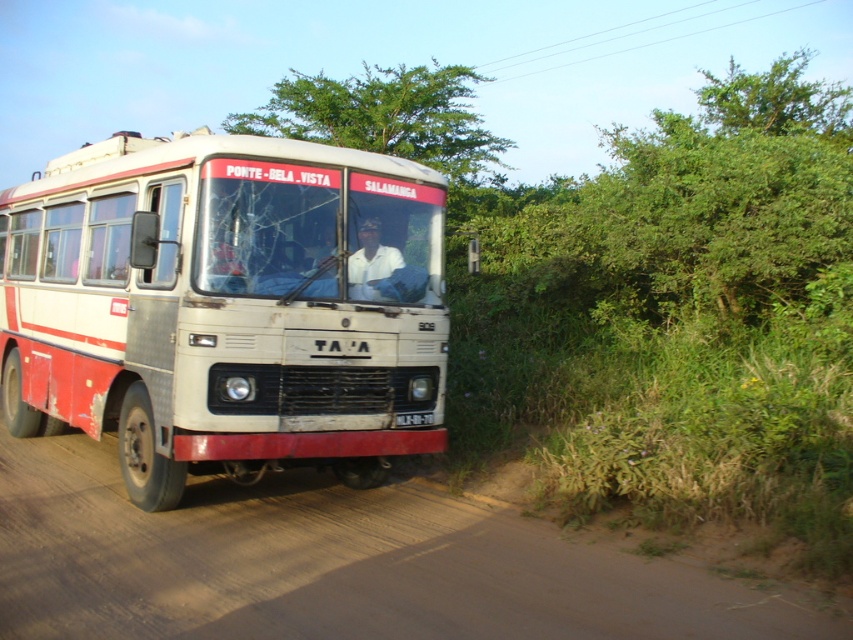
Measure the distance from white matte bus at center to brown dirt track at lower center.

white matte bus at center is 5.76 feet from brown dirt track at lower center.

Is white matte bus at center in front of brown dirt track at lower center?

No, white matte bus at center is further to the viewer.

The width and height of the screenshot is (853, 640). In order to click on white matte bus at center in this screenshot , I will do `click(222, 307)`.

Is white matte bus at center taller than black plastic license plate at center?

Indeed, white matte bus at center has a greater height compared to black plastic license plate at center.

Which is behind, point (357, 193) or point (399, 420)?

Point (399, 420)

Who is more forward, (302, 208) or (393, 422)?

Point (302, 208) is in front.

You are a GUI agent. You are given a task and a screenshot of the screen. Output one action in this format:
    pyautogui.click(x=<x>, y=<y>)
    Task: Click on the white matte bus at center
    The width and height of the screenshot is (853, 640).
    Given the screenshot: What is the action you would take?
    pyautogui.click(x=222, y=307)

How distant is white matte shirt at center from black plastic license plate at center?

A distance of 1.27 meters exists between white matte shirt at center and black plastic license plate at center.

Identify the location of white matte shirt at center. (370, 262).

Which is behind, point (370, 241) or point (419, 419)?

The point (419, 419) is behind.

At what (x,y) coordinates should I click in order to perform the action: click on white matte shirt at center. Please return your answer as a coordinate pair (x, y). This screenshot has height=640, width=853. Looking at the image, I should click on (370, 262).